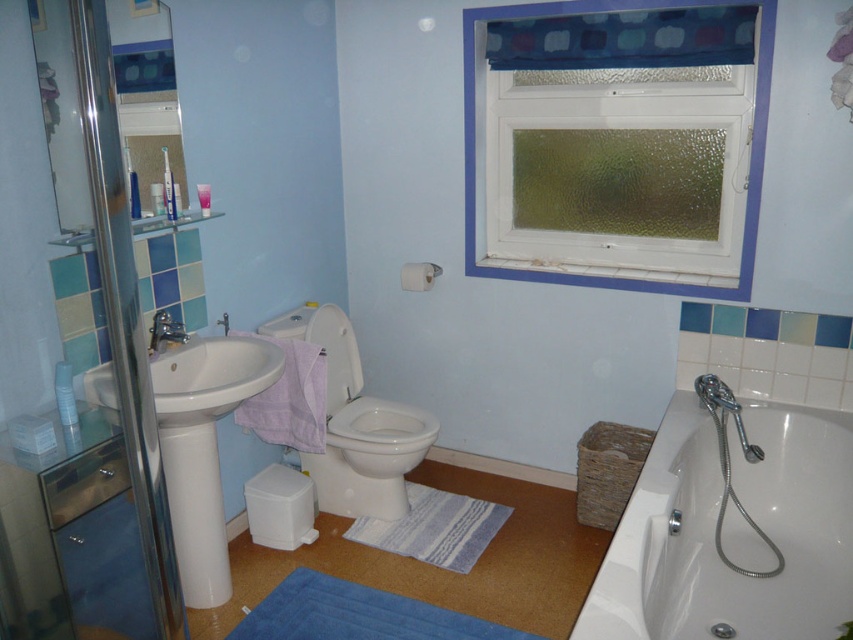
You are standing in the bathroom and want to enter the transparent glass shower door at left. To do so, do you need to step over the white glossy toilet bowl at center?

Yes, you need to step over the white glossy toilet bowl at center because the transparent glass shower door at left is positioned over it.

You are standing in the bathroom and need to place a new decorative plant between the transparent glass shower door at left and the blue plush bath mat at lower center. Based on their positions, where should you place the plant to ensure it is between them?

The transparent glass shower door at left is positioned on the left side of blue plush bath mat at lower center, so you should place the plant between them to the right of the shower door and to the left of the bath mat.

In the bathroom scene, you need to determine which object takes up more space. You see the transparent glass shower door at left and the white glossy toilet bowl at center. Which one occupies more area in the image?

The white glossy toilet bowl at center occupies more area than the transparent glass shower door at left because the transparent glass shower door at left occupies less space than white glossy toilet bowl at center.